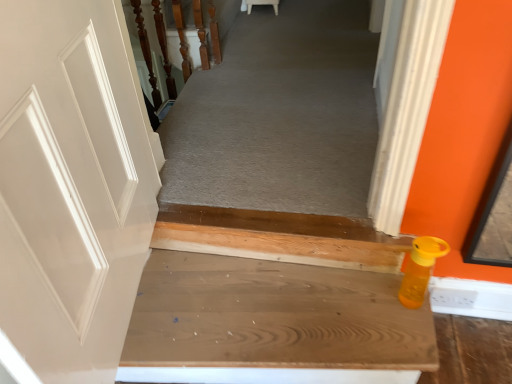
In order to click on free space to the left of orange matte bottle at lower right in this screenshot , I will do `click(364, 309)`.